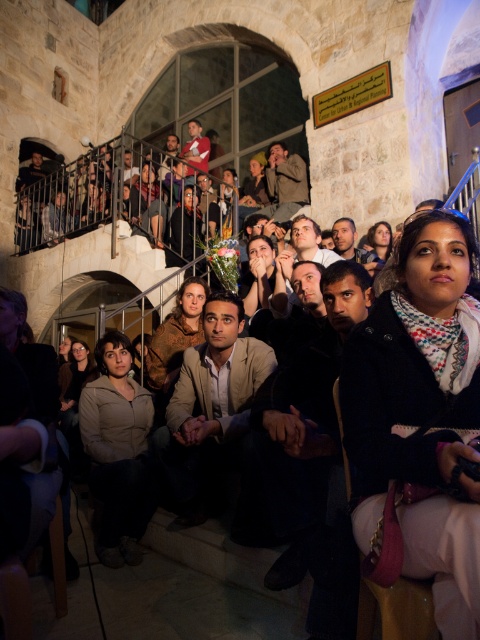
You are standing in the courtyard and need to place a small potted plant exactly at the coordinates mentioned for the dark brown leather jacket at center. Is there enough space there to place the plant without moving the jacket?

The dark brown leather jacket at center is located at point (312, 456), so yes, there is enough space to place the small potted plant at those coordinates without moving the jacket.

You are a photographer setting up for an event in the courtyard. You notice the dark blue shirt at upper center and the smooth brown leather jacket at upper center. Which clothing item is wider?

The dark blue shirt at upper center is wider than the smooth brown leather jacket at upper center according to the description provided.